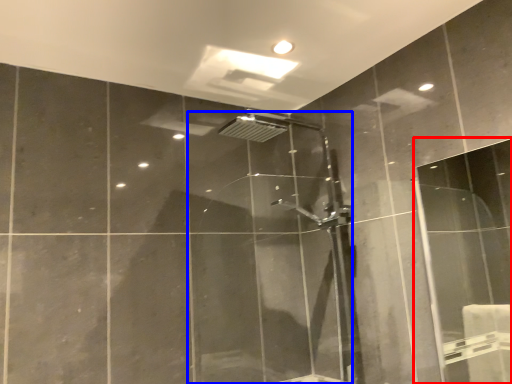
Question: Which object is closer to the camera taking this photo, screen door (highlighted by a red box) or shower door (highlighted by a blue box)?

Choices:
 (A) screen door
 (B) shower door

Answer: (A)